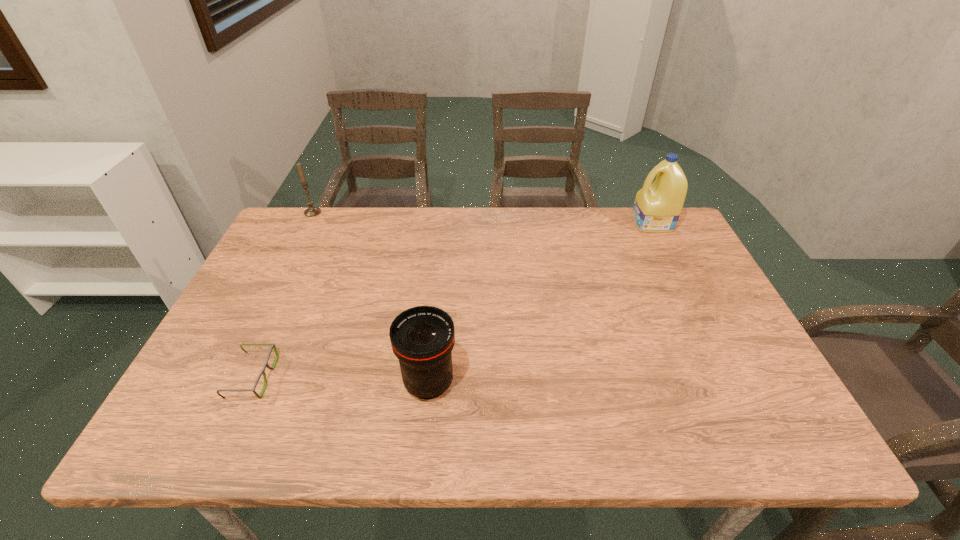
Where is `free space located on the lens of the spectacles`? free space located on the lens of the spectacles is located at coordinates (390, 377).

You are a GUI agent. You are given a task and a screenshot of the screen. Output one action in this format:
    pyautogui.click(x=<x>, y=<y>)
    Task: Click on the detergent that is at the far edge
    The width and height of the screenshot is (960, 540).
    Given the screenshot: What is the action you would take?
    point(657,207)

Find the location of a particular element. This screenshot has height=540, width=960. candle located in the far edge section of the desktop is located at coordinates click(312, 211).

This screenshot has height=540, width=960. What are the coordinates of `object situated at the near edge` in the screenshot? It's located at [x=422, y=337].

At what (x,y) coordinates should I click in order to perform the action: click on candle that is at the left edge. Please return your answer as a coordinate pair (x, y). Looking at the image, I should click on (312, 211).

Find the location of `spectacles present at the left edge`. spectacles present at the left edge is located at coordinates (272, 345).

At what (x,y) coordinates should I click in order to perform the action: click on object present at the right edge. Please return your answer as a coordinate pair (x, y). Image resolution: width=960 pixels, height=540 pixels. Looking at the image, I should click on (657, 207).

This screenshot has width=960, height=540. Identify the location of object positioned at the far left corner. click(x=312, y=211).

Where is `object at the far right corner`? The height and width of the screenshot is (540, 960). object at the far right corner is located at coordinates (657, 207).

Identify the location of blank space at the far edge of the desktop. (521, 228).